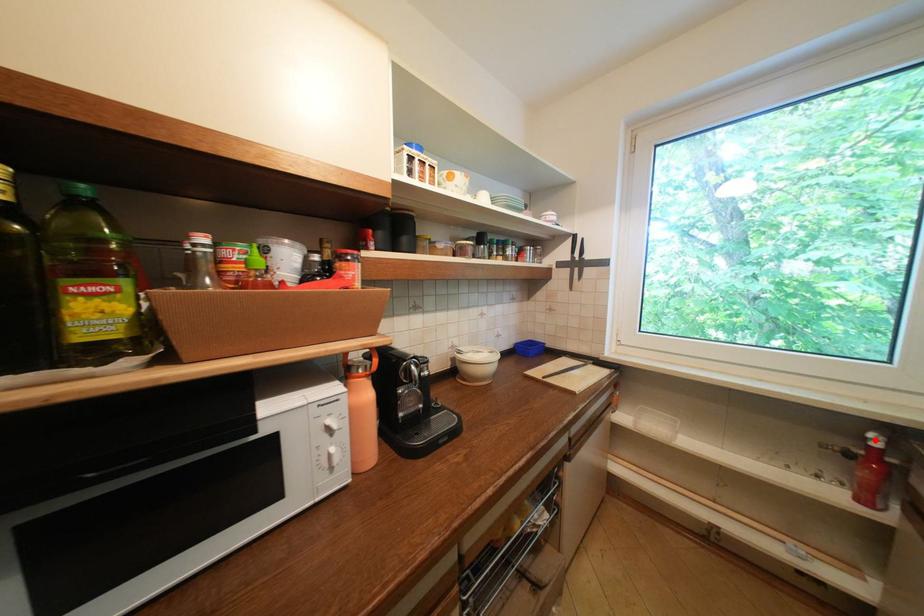
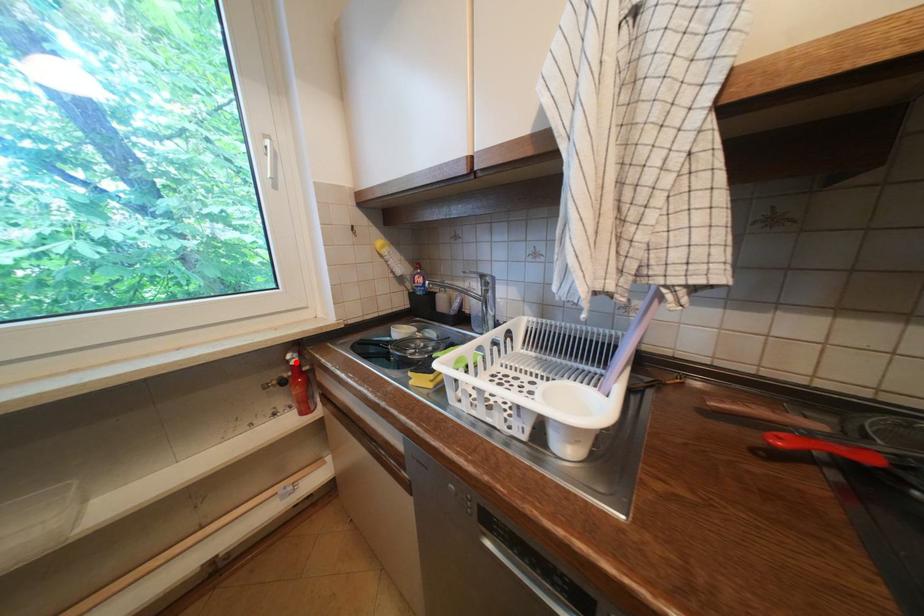
I am providing you with two images of the same scene from different viewpoints. A red point is marked on the first image and another point is marked on the second image. Does the point marked in image1 correspond to the same location as the one in image2?

Yes